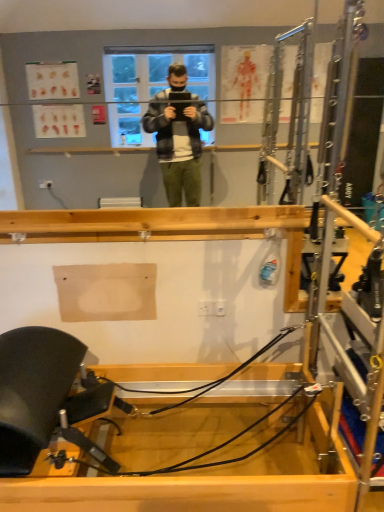
Identify the location of wooden pilates reformer at center. (207, 484).

Describe the element at coordinates (207, 484) in the screenshot. This screenshot has height=512, width=384. I see `wooden pilates reformer at center` at that location.

This screenshot has width=384, height=512. I want to click on wooden pilates reformer at center, so click(207, 484).